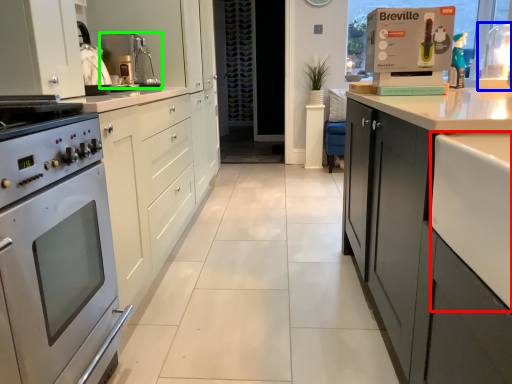
Question: Which object is the farthest from counter top (highlighted by a red box)? Choose among these: appliance (highlighted by a blue box) or kitchen appliance (highlighted by a green box).

Choices:
 (A) appliance
 (B) kitchen appliance

Answer: (A)